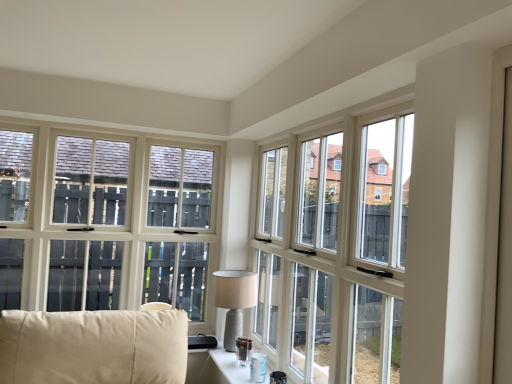
Question: Is matte gray lamp at center inside the boundaries of clear glass table at lower center, or outside?

Choices:
 (A) outside
 (B) inside

Answer: (A)

Question: Would you say matte gray lamp at center is to the left or to the right of clear glass table at lower center in the picture?

Choices:
 (A) right
 (B) left

Answer: (B)

Question: Which is farther from the matte gray lamp at center?

Choices:
 (A) transparent glass window at center
 (B) clear glass table at lower center

Answer: (A)

Question: Which object is the farthest from the clear glass table at lower center?

Choices:
 (A) transparent glass window at center
 (B) matte gray lamp at center

Answer: (A)